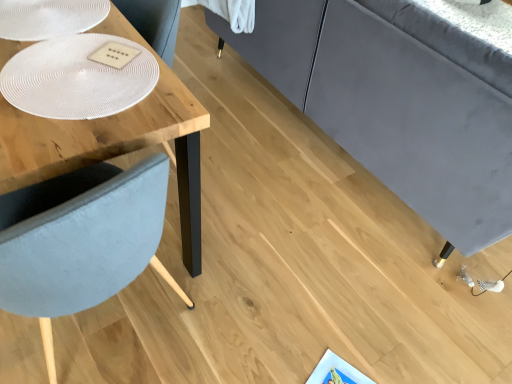
Question: From the image's perspective, is white textured glass plate at upper left, marked as the second glass plate in a top-to-bottom arrangement, located above or below white textured glass plate at upper left, the 1th glass plate when ordered from top to bottom?

Choices:
 (A) above
 (B) below

Answer: (B)

Question: Is white textured glass plate at upper left, marked as the second glass plate in a top-to-bottom arrangement, situated inside white textured glass plate at upper left, which is the 2th glass plate in bottom-to-top order, or outside?

Choices:
 (A) outside
 (B) inside

Answer: (A)

Question: Which object is the closest to the white textured glass plate at upper left, the 1th glass plate when ordered from top to bottom?

Choices:
 (A) wooden table at left
 (B) white textured glass plate at upper left, marked as the first glass plate in a bottom-to-top arrangement

Answer: (A)

Question: Based on their relative distances, which object is nearer to the white textured glass plate at upper left, which is the 2th glass plate in bottom-to-top order?

Choices:
 (A) white textured glass plate at upper left, marked as the second glass plate in a top-to-bottom arrangement
 (B) wooden table at left

Answer: (B)